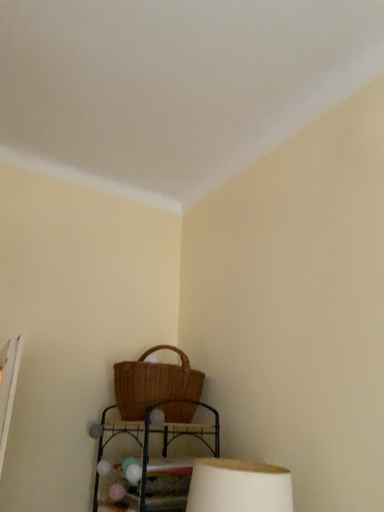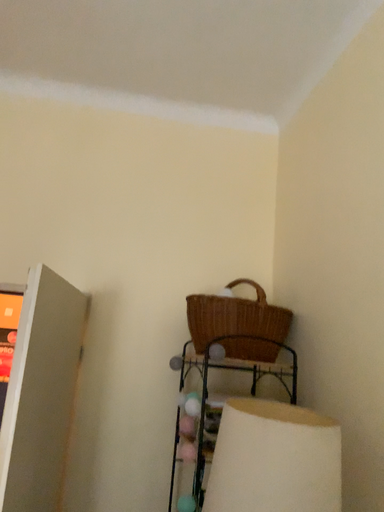
Question: Which way did the camera rotate in the video?

Choices:
 (A) rotated right
 (B) rotated left

Answer: (B)